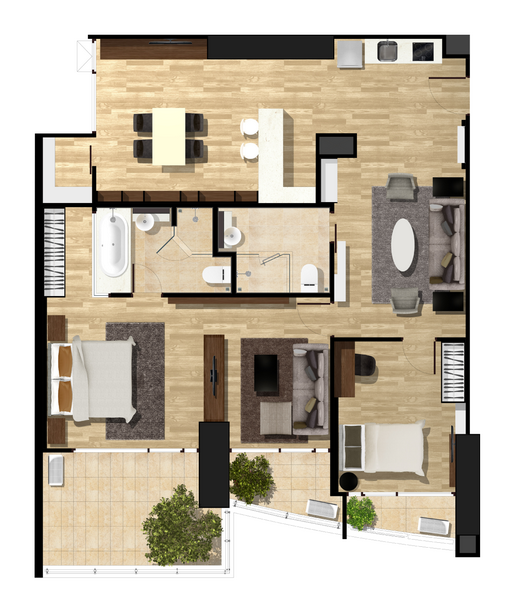
The width and height of the screenshot is (515, 596). I want to click on bar, so click(270, 163).